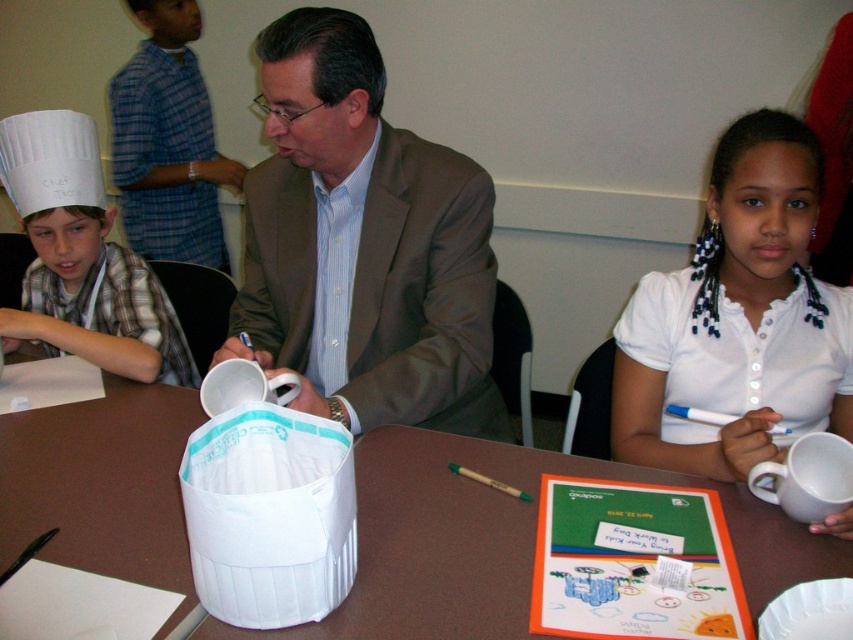
You are organizing a cooking class and need to arrange the brown fabric suit at center and the white matte shirt at upper right for a demonstration. Based on their positions in the image, which item is placed higher up?

The brown fabric suit at center is located above the white matte shirt at upper right, so it is placed higher up.

You are organizing a children cooking class and need to determine which clothing item is more suitable for a child based on size. The brown fabric suit at center and the white matte shirt at upper right are available. Which one would you choose and why?

The white matte shirt at upper right is more suitable for a child because the brown fabric suit at center is larger in size compared to the white matte shirt at upper right.